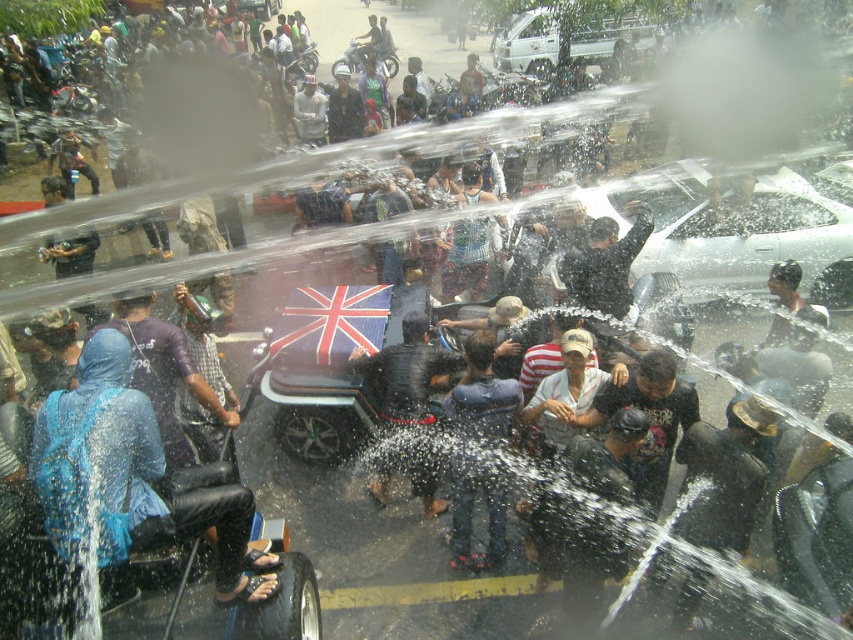
You are standing at the center of the street and see the blue fabric umbrella at left. Which direction should you move to get closer to it?

Since the blue fabric umbrella at left is located at point (132,477), you should move to your left to get closer to it.

You are a photographer trying to capture a clear shot of the dark blue fabric umbrella at center without the blue fabric umbrella at left blocking it. Based on their positions, is this possible?

The blue fabric umbrella at left is below the dark blue fabric umbrella at center, so it might be possible to angle the camera upwards to avoid the obstruction from the lower umbrella.

You are a photographer trying to capture the motorcycle with the Union Jack flag in the center of the image. There is a blue fabric umbrella at left located at point (x=132, y=477). To avoid the umbrella blocking the motorcycle, should you move to your left or right?

The blue fabric umbrella at left is located at point (x=132, y=477). To avoid the umbrella blocking the motorcycle, you should move to your right.